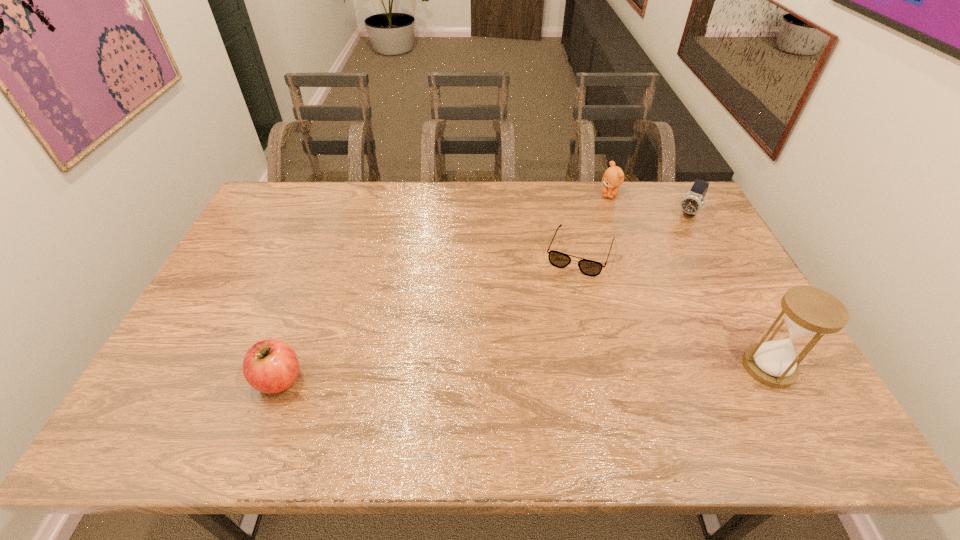
This screenshot has width=960, height=540. I want to click on vacant space located 0.270m on the face of the watch, so click(x=654, y=266).

This screenshot has width=960, height=540. What are the coordinates of `vacant space located on the face of the watch` in the screenshot? It's located at (676, 234).

I want to click on free spot located 0.200m on the front-facing side of the third farthest object, so click(553, 324).

The width and height of the screenshot is (960, 540). I want to click on free location located on the front-facing side of the third farthest object, so click(550, 332).

You are a GUI agent. You are given a task and a screenshot of the screen. Output one action in this format:
    pyautogui.click(x=<x>, y=<y>)
    Task: Click on the free point located on the front-facing side of the third farthest object
    
    Given the screenshot: What is the action you would take?
    pyautogui.click(x=547, y=341)

Where is `vacant area situated 0.310m on the face of the teddy bear`? vacant area situated 0.310m on the face of the teddy bear is located at coordinates (585, 254).

Find the location of `free location located on the face of the teddy bear`. free location located on the face of the teddy bear is located at coordinates (597, 225).

Locate an element on the screen. free location located 0.320m on the face of the teddy bear is located at coordinates (584, 256).

Find the location of a particular element. The height and width of the screenshot is (540, 960). watch positioned at the far edge is located at coordinates (691, 203).

Identify the location of teddy bear positioned at the far edge. Image resolution: width=960 pixels, height=540 pixels. (613, 177).